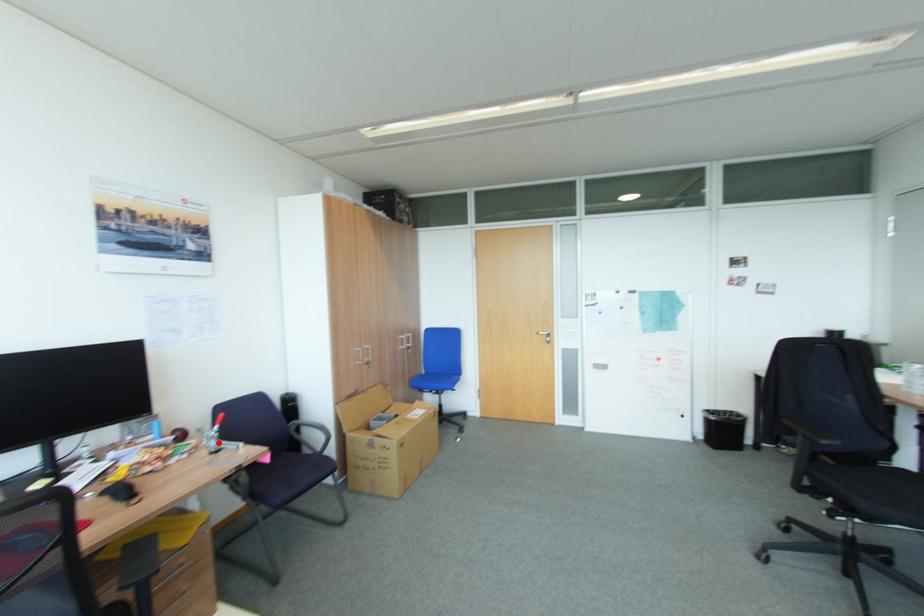
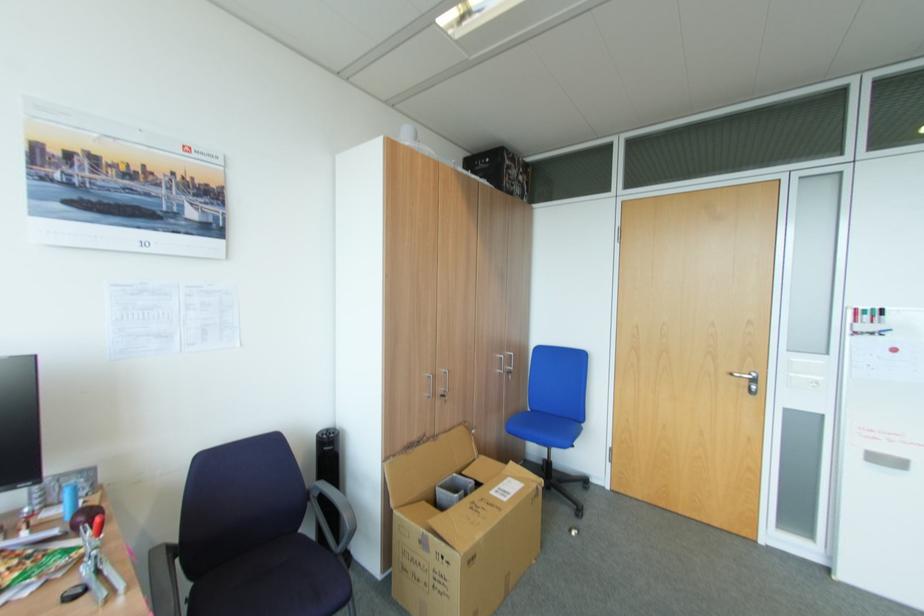
Where in the second image is the point corresponding to the highlighted location from the first image?

(91, 569)